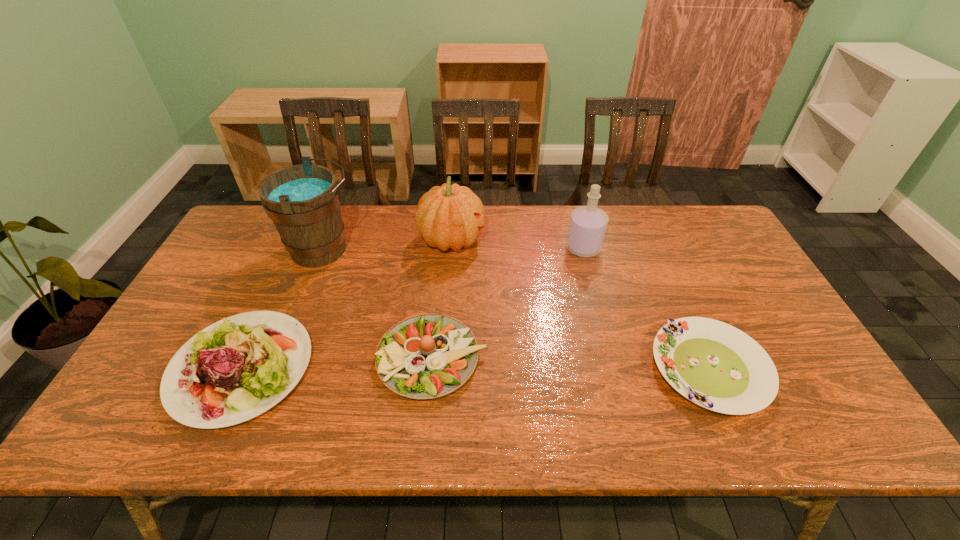
Find the location of a particular element. free spot between the second salad plate from left to right and the second object from right to left is located at coordinates (508, 303).

Image resolution: width=960 pixels, height=540 pixels. I want to click on empty space between the leftmost salad plate and the wine bucket, so click(282, 309).

Locate an element on the screen. The width and height of the screenshot is (960, 540). blank region between the rightmost salad plate and the second object from right to left is located at coordinates (646, 308).

Find the location of `vacant space in between the pumpkin and the wine bucket`. vacant space in between the pumpkin and the wine bucket is located at coordinates (388, 245).

Image resolution: width=960 pixels, height=540 pixels. Find the location of `object that is the third nearest to the second object from right to left`. object that is the third nearest to the second object from right to left is located at coordinates (427, 356).

The height and width of the screenshot is (540, 960). I want to click on object that is the third nearest to the leftmost salad plate, so click(451, 216).

Identify the location of the closest salad plate to the leftmost salad plate. (427, 356).

Locate an element on the screen. salad plate that is the second nearest to the perfume is located at coordinates (427, 356).

The image size is (960, 540). Find the location of `free space in the image that satisfies the following two spatial constraints: 1. on the carved face of the pumpkin; 2. on the front side of the second salad plate from left to right`. free space in the image that satisfies the following two spatial constraints: 1. on the carved face of the pumpkin; 2. on the front side of the second salad plate from left to right is located at coordinates (443, 359).

Identify the location of free spot that satisfies the following two spatial constraints: 1. on the carved face of the perfume; 2. on the left side of the pumpkin. This screenshot has width=960, height=540. (451, 248).